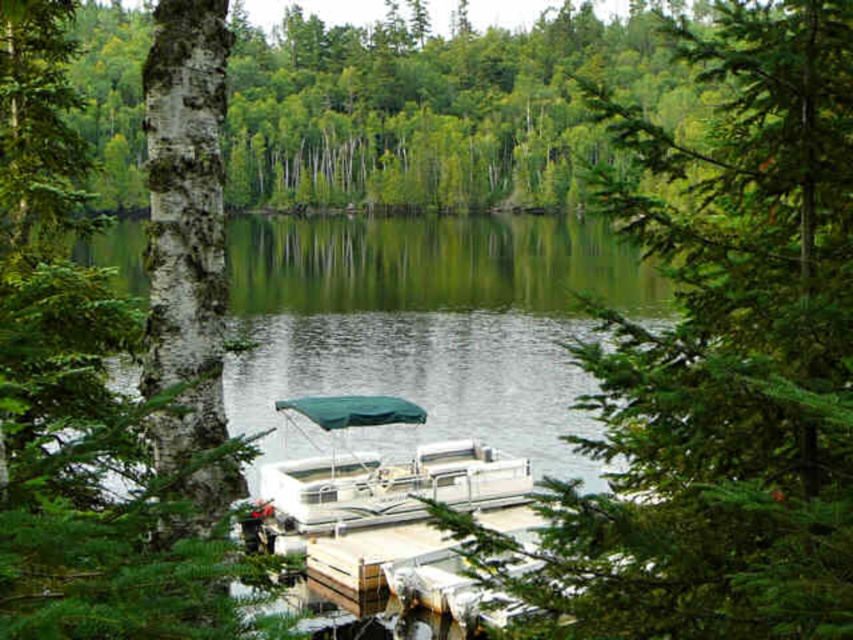
Question: Which of the following is the farthest from the observer?

Choices:
 (A) (379, 508)
 (B) (125, 540)

Answer: (A)

Question: Is green matte tree at center to the right of white plastic pontoon boat at center from the viewer's perspective?

Choices:
 (A) no
 (B) yes

Answer: (B)

Question: Does green matte tree at center have a larger size compared to white plastic pontoon boat at center?

Choices:
 (A) yes
 (B) no

Answer: (A)

Question: Which point is farther to the camera?

Choices:
 (A) (834, 544)
 (B) (428, 467)
 (C) (447, 262)
 (D) (132, 548)

Answer: (C)

Question: Which point is farther to the camera?

Choices:
 (A) (260, 506)
 (B) (724, 627)
 (C) (90, 324)

Answer: (A)

Question: Is white bark tree at left further to the viewer compared to green smooth water at center?

Choices:
 (A) yes
 (B) no

Answer: (B)